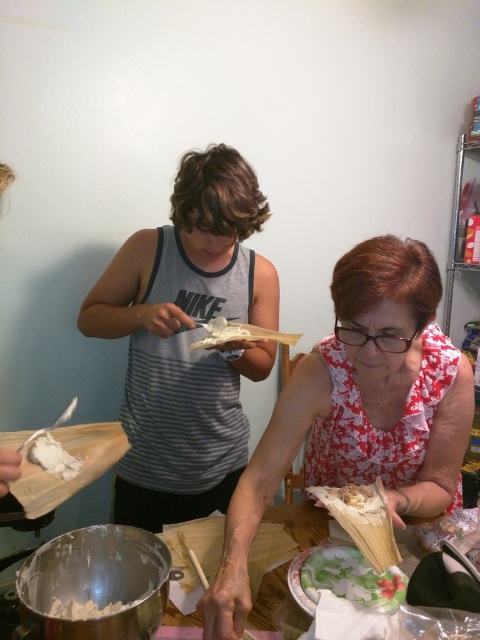
Question: Which object is the closest to the gray striped tank top at center?

Choices:
 (A) wooden table at center
 (B) floral printed blouse at center
 (C) white paper wrapper at lower center

Answer: (B)

Question: Does floral printed blouse at center appear on the right side of white creamy paste at lower left?

Choices:
 (A) no
 (B) yes

Answer: (B)

Question: Among these points, which one is nearest to the camera?

Choices:
 (A) (421, 312)
 (B) (33, 548)
 (C) (75, 458)
 (D) (137, 426)

Answer: (C)

Question: Which of the following is the closest to the observer?

Choices:
 (A) (116, 605)
 (B) (181, 212)
 (C) (376, 468)
 (D) (292, 524)

Answer: (A)

Question: Can you confirm if white paper wrapper at lower center is bigger than wooden table at center?

Choices:
 (A) no
 (B) yes

Answer: (A)

Question: Does gray striped tank top at center appear under white creamy paste at lower left?

Choices:
 (A) no
 (B) yes

Answer: (A)